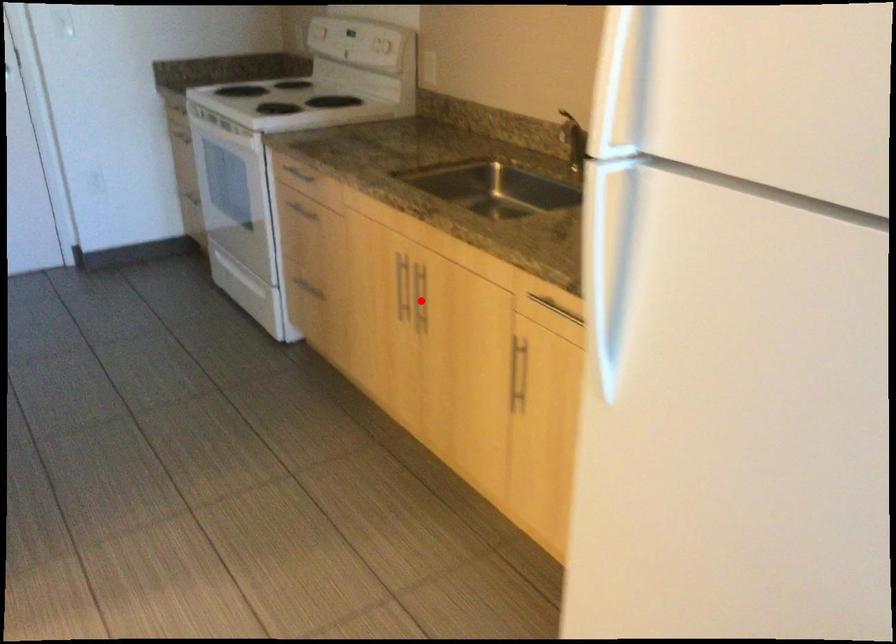
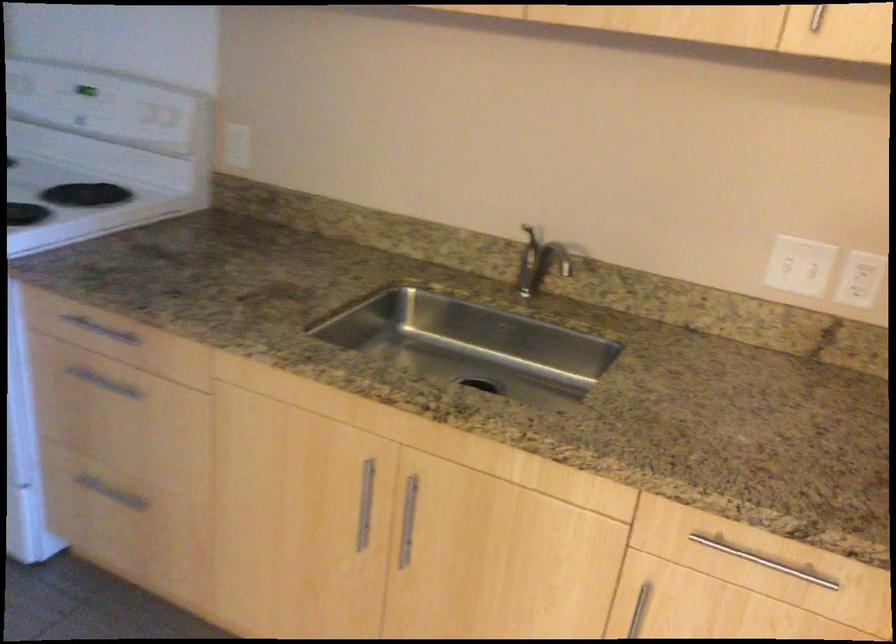
Question: I am providing you with two images of the same scene from different viewpoints. In image1, a red point is highlighted. Considering the same 3D point in image2, which of the following is correct?

Choices:
 (A) It is closer
 (B) It is farther

Answer: (A)